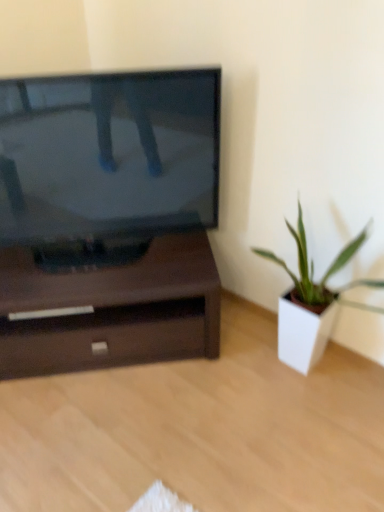
Describe the element at coordinates (312, 301) in the screenshot. I see `green matte plant at right` at that location.

This screenshot has width=384, height=512. What are the coordinates of `green matte plant at right` in the screenshot? It's located at click(312, 301).

The image size is (384, 512). Identify the location of green matte plant at right. (312, 301).